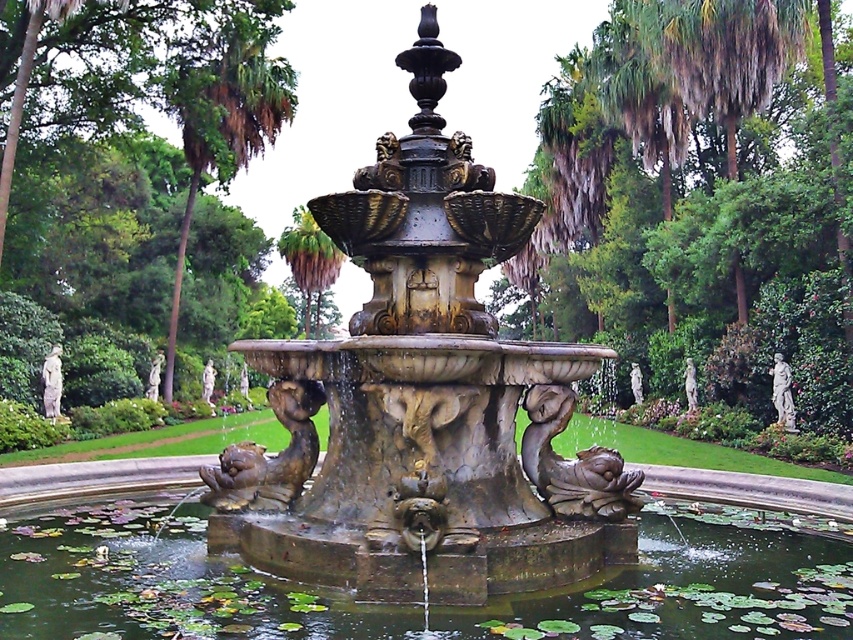
You are standing in the garden and want to take a photo of the green mossy water at center and the green leafy palm tree at upper center. Which object should you focus on first if you want to capture both in the frame without moving the camera?

You should focus on the green leafy palm tree at upper center first because the green mossy water at center is to the right of it, so by centering the palm tree, the water will naturally be included to its right in the frame.

You are standing at the edge of the circular pool in the garden. There is a point marked at coordinates (422, 401). Which object in the scene does this point most likely represent?

The point at coordinates (422, 401) most likely represents the bronze fountain at center, as it is centrally located in the scene.